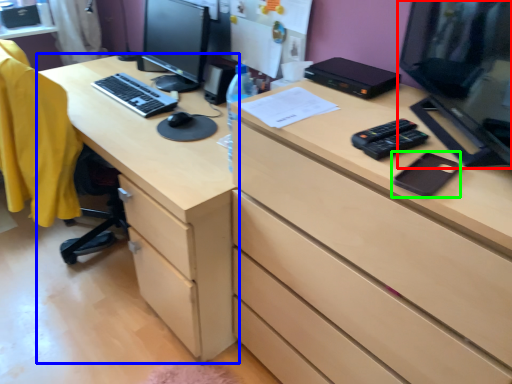
Question: Estimate the real-world distances between objects in this image. Which object is farther from computer monitor (highlighted by a red box), desk (highlighted by a blue box) or notepad (highlighted by a green box)?

Choices:
 (A) desk
 (B) notepad

Answer: (A)